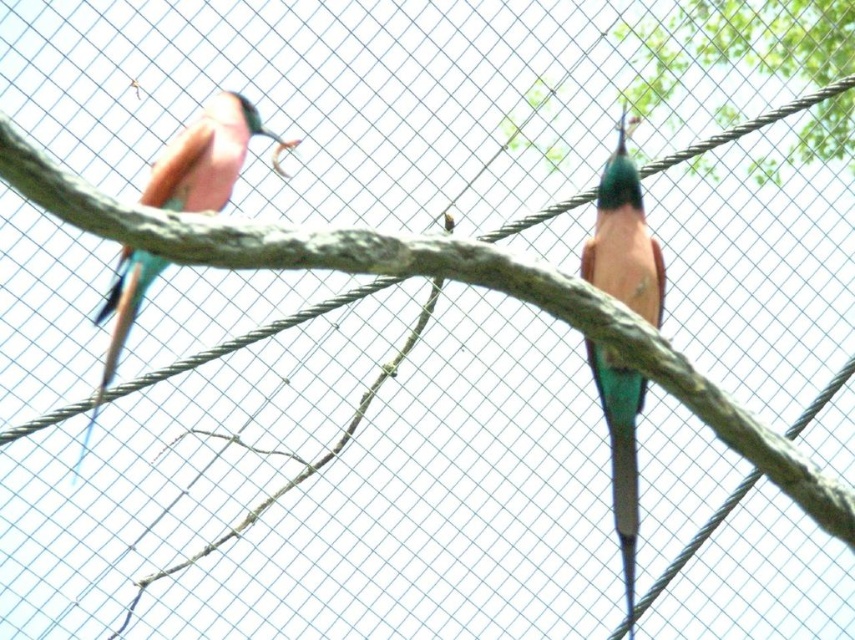
From the picture: You are a zookeeper observing the teal glossy parrot at center and the pink glossy bird at left. Which bird is positioned closer to you?

The teal glossy parrot at center is closer to the viewer than the pink glossy bird at left.

You are a zookeeper observing two birds in an enclosure. You see a teal glossy parrot at center and a pink glossy bird at left. Which bird is positioned lower in the scene?

The teal glossy parrot at center is positioned lower than the pink glossy bird at left.